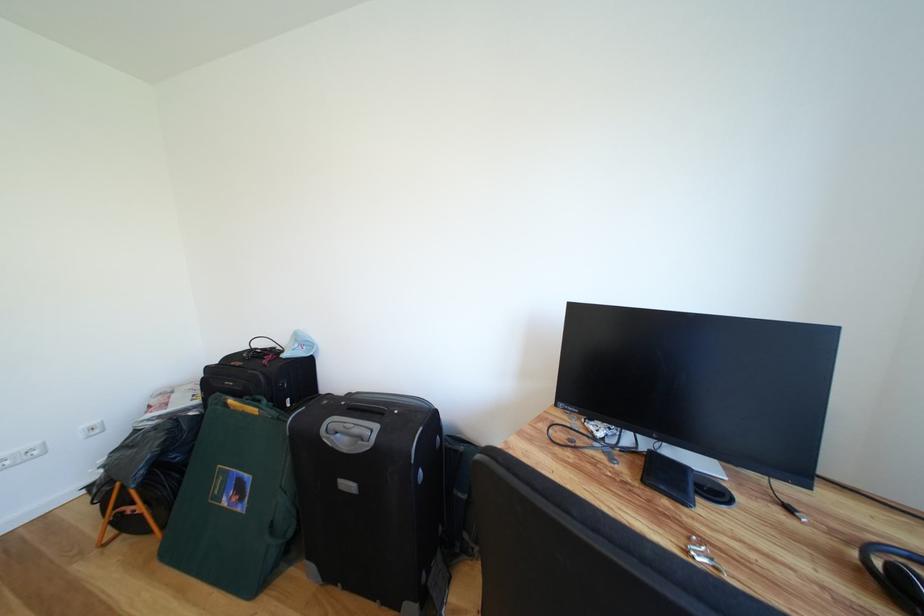
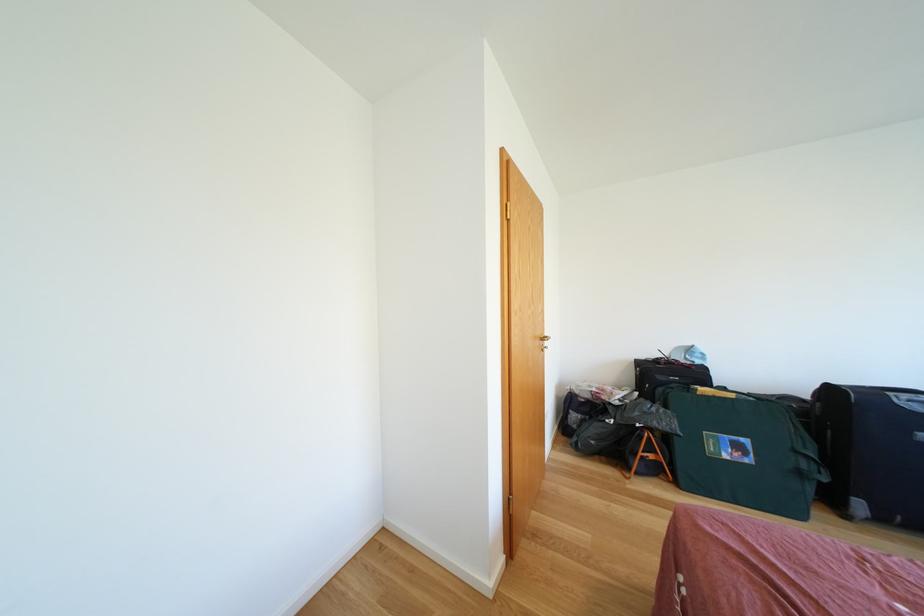
The images are taken continuously from a first-person perspective. In which direction are you moving?

The cameraman moved toward left, backward.